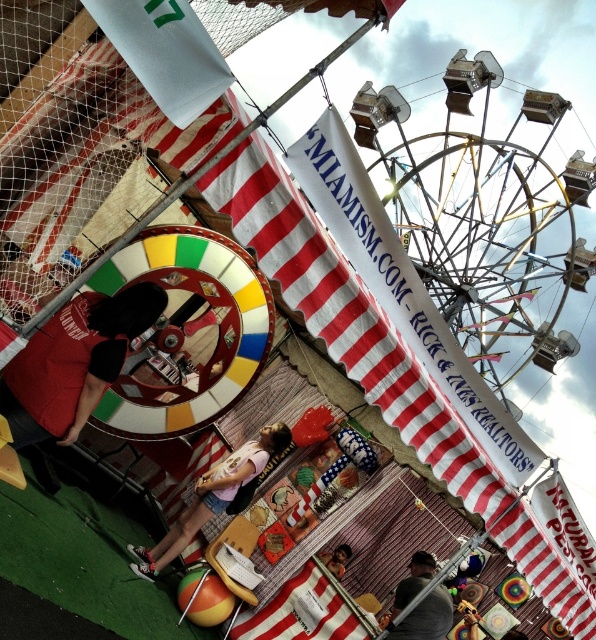
You are standing at the carnival and want to take a photo of the spinning wheel game. There are two points marked on the ground, point (30, 385) and point (175, 550). Which point should you stand closer to in order to have the spinning wheel game fill more of your camera frame?

You should stand closer to point (30, 385) because it is closer to the camera, allowing the spinning wheel game to fill more of the camera frame.

You are a photographer trying to capture both the metallic ferris wheel at upper center and the smooth skin face at lower center in a single photo. Based on their heights, which object should you focus on first to ensure both are in frame?

The metallic ferris wheel at upper center is taller than the smooth skin face at lower center, so you should focus on the metallic ferris wheel at upper center first to ensure both are in frame.